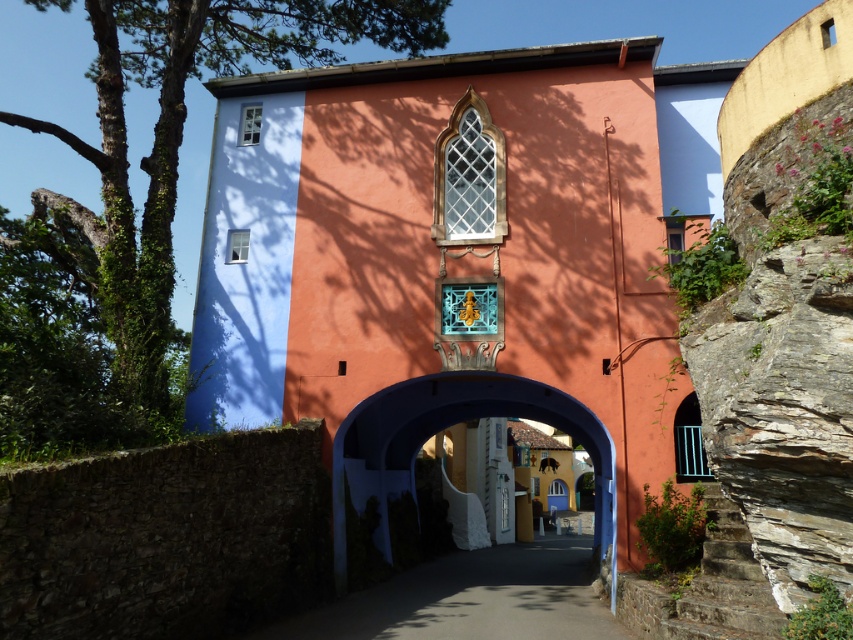
Who is taller, brown stone wall at lower left or paved concrete alley at center?

paved concrete alley at center is taller.

Is brown stone wall at lower left bigger than paved concrete alley at center?

Incorrect, brown stone wall at lower left is not larger than paved concrete alley at center.

Does point (216, 520) come in front of point (316, 618)?

Yes, it is.

In order to click on brown stone wall at lower left in this screenshot , I will do `click(167, 538)`.

Does green leafy tree at upper left lie in front of blue matte archway at center?

Yes, green leafy tree at upper left is closer to the viewer.

Who is positioned more to the left, green leafy tree at upper left or blue matte archway at center?

green leafy tree at upper left is more to the left.

Is point (407, 26) behind point (335, 554)?

Yes, point (407, 26) is behind point (335, 554).

You are a GUI agent. You are given a task and a screenshot of the screen. Output one action in this format:
    pyautogui.click(x=<x>, y=<y>)
    Task: Click on the green leafy tree at upper left
    
    Given the screenshot: What is the action you would take?
    pyautogui.click(x=183, y=129)

Does point (54, 582) come farther from viewer compared to point (360, 22)?

No, (54, 582) is in front of (360, 22).

This screenshot has height=640, width=853. What are the coordinates of `brown stone wall at lower left` in the screenshot? It's located at (167, 538).